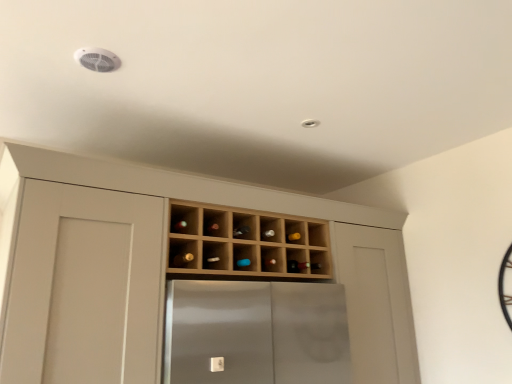
Question: Is matte brown wine bottle at center, the first wine bottle positioned from the left, wider than wooden wine rack at center?

Choices:
 (A) no
 (B) yes

Answer: (A)

Question: Is matte brown wine bottle at center, the second wine bottle when ordered from back to front, not inside wooden wine rack at center?

Choices:
 (A) yes
 (B) no

Answer: (B)

Question: From the image's perspective, is matte brown wine bottle at center, the second wine bottle when ordered from bottom to top, on wooden wine rack at center?

Choices:
 (A) yes
 (B) no

Answer: (B)

Question: Does matte brown wine bottle at center, the second wine bottle when ordered from back to front, have a smaller size compared to wooden wine rack at center?

Choices:
 (A) no
 (B) yes

Answer: (B)

Question: From the image's perspective, does matte brown wine bottle at center, the second wine bottle when ordered from bottom to top, appear lower than wooden wine rack at center?

Choices:
 (A) no
 (B) yes

Answer: (B)

Question: In terms of size, does translucent glass wine bottle at center, the 1th wine bottle positioned from the right, appear bigger or smaller than light wood wine rack at center?

Choices:
 (A) small
 (B) big

Answer: (A)

Question: Based on their positions, is translucent glass wine bottle at center, the 2th wine bottle positioned from the top, located to the left or right of light wood wine rack at center?

Choices:
 (A) right
 (B) left

Answer: (A)

Question: From the image's perspective, is translucent glass wine bottle at center, arranged as the 2th wine bottle when viewed from the left, positioned above or below light wood wine rack at center?

Choices:
 (A) above
 (B) below

Answer: (A)

Question: In the image, is translucent glass wine bottle at center, arranged as the 2th wine bottle when viewed from the left, positioned in front of or behind light wood wine rack at center?

Choices:
 (A) behind
 (B) front

Answer: (A)

Question: Which is correct: translucent glass wine bottle at center, the 2th wine bottle positioned from the top, is inside wooden wine rack at center, or outside of it?

Choices:
 (A) outside
 (B) inside

Answer: (B)

Question: Is translucent glass wine bottle at center, the 2th wine bottle in the front-to-back sequence, taller or shorter than wooden wine rack at center?

Choices:
 (A) short
 (B) tall

Answer: (A)

Question: Is point (314, 264) positioned closer to the camera than point (263, 246)?

Choices:
 (A) closer
 (B) farther

Answer: (B)

Question: Would you say translucent glass wine bottle at center, the 2th wine bottle in the front-to-back sequence, is to the left or to the right of wooden wine rack at center in the picture?

Choices:
 (A) right
 (B) left

Answer: (A)

Question: Is matte brown wine bottle at center, the second wine bottle when ordered from bottom to top, bigger or smaller than wooden wine rack at center?

Choices:
 (A) small
 (B) big

Answer: (A)

Question: Relative to wooden wine rack at center, is matte brown wine bottle at center, the second wine bottle when ordered from bottom to top, in front or behind?

Choices:
 (A) front
 (B) behind

Answer: (B)